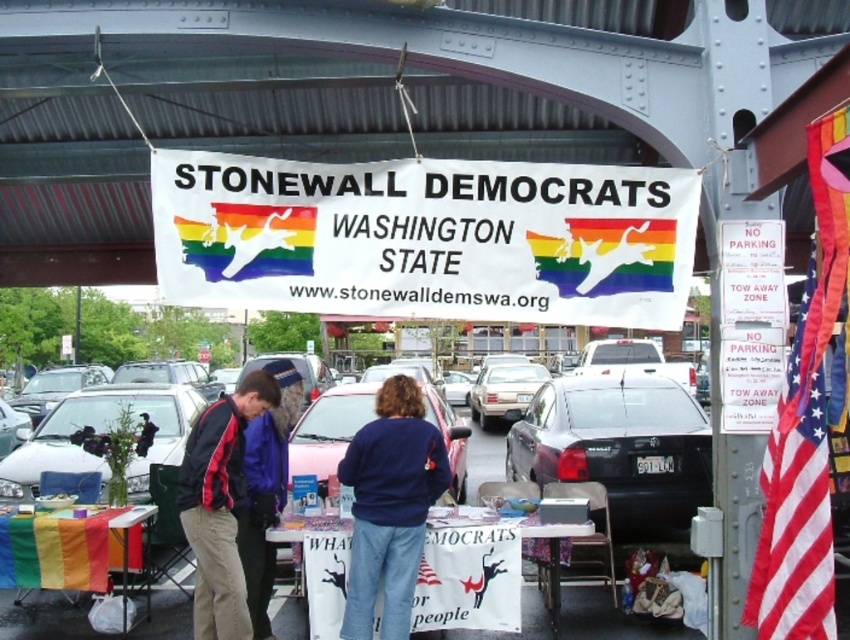
You are standing at the event and want to hand out a pamphlet to a person wearing the blue fleece jacket at center. However, there is a black glossy sedan at center in your way. Can you reach the person without moving the car?

The black glossy sedan at center is further to the viewer than blue fleece jacket at center, so the sedan is behind the person wearing the blue fleece jacket at center. Therefore, you can reach the person without moving the car.

You are a photographer at the event and want to capture the white metal overpass at upper center and the matte silver sedan at center in the same frame. Which object should you position closer to the camera to ensure both are visible?

To capture both the white metal overpass at upper center and the matte silver sedan at center in the same frame, position the white metal overpass at upper center closer to the camera since it is in front of the matte silver sedan at center.